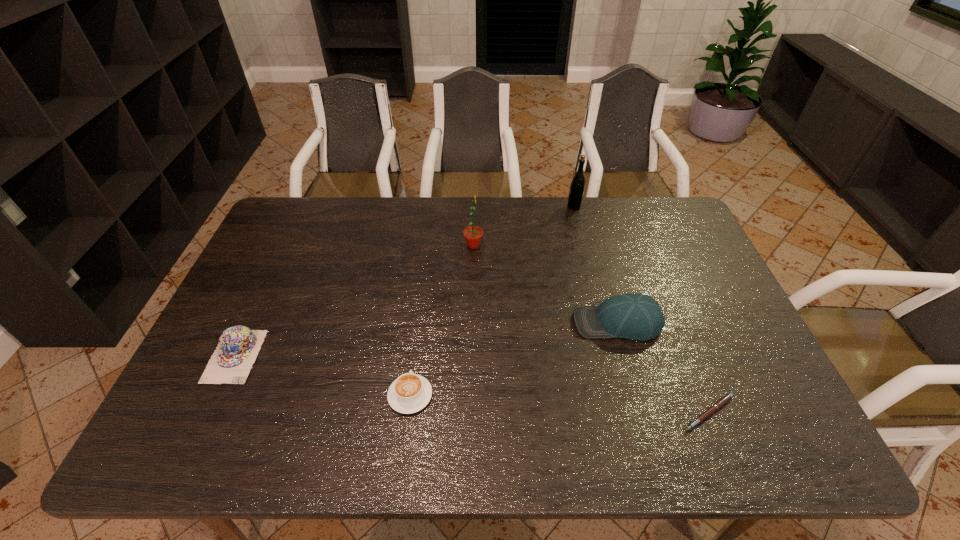
Locate an element on the screen. This screenshot has height=540, width=960. blank space located on the face of the fifth nearest object is located at coordinates (589, 245).

The height and width of the screenshot is (540, 960). Find the location of `vacant point located on the front of the baseball cap`. vacant point located on the front of the baseball cap is located at coordinates (631, 372).

Find the location of a particular element. The height and width of the screenshot is (540, 960). vacant space located 0.060m on the front, side, and top of the leftmost object is located at coordinates (211, 407).

At what (x,y) coordinates should I click in order to perform the action: click on vacant space located on the side of the fifth tallest object with the handle. Please return your answer as a coordinate pair (x, y). Looking at the image, I should click on (418, 334).

Where is `vacant space located 0.370m on the side of the fifth tallest object with the handle`? The image size is (960, 540). vacant space located 0.370m on the side of the fifth tallest object with the handle is located at coordinates (425, 272).

Locate an element on the screen. This screenshot has width=960, height=540. free space located 0.050m on the side of the fifth tallest object with the handle is located at coordinates (415, 359).

Where is `beer bottle located in the far edge section of the desktop`? beer bottle located in the far edge section of the desktop is located at coordinates (577, 186).

This screenshot has height=540, width=960. I want to click on sunflower at the far edge, so click(473, 234).

Locate an element on the screen. The image size is (960, 540). object situated at the near edge is located at coordinates (726, 398).

This screenshot has height=540, width=960. Identify the location of object that is positioned at the left edge. (238, 347).